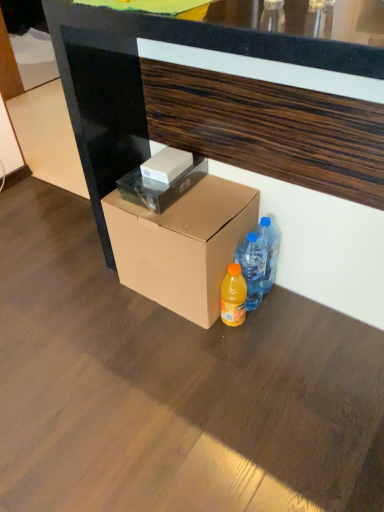
At what (x,y) coordinates should I click in order to perform the action: click on vacant space in front of white glossy box at center, placed as the 2th box when sorted from bottom to top. Please return your answer as a coordinate pair (x, y). The image size is (384, 512). Looking at the image, I should click on (170, 221).